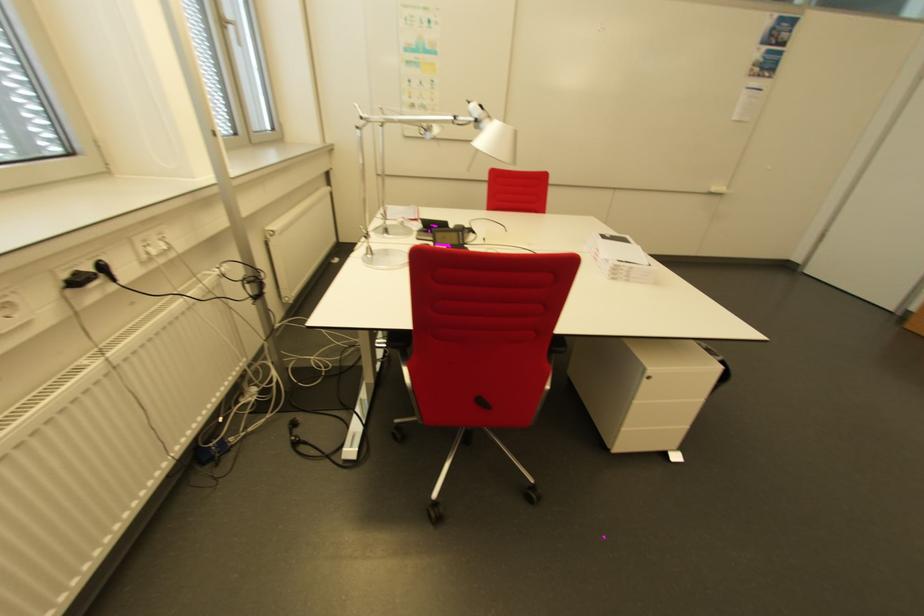
The image size is (924, 616). Describe the element at coordinates (229, 22) in the screenshot. I see `the window handle` at that location.